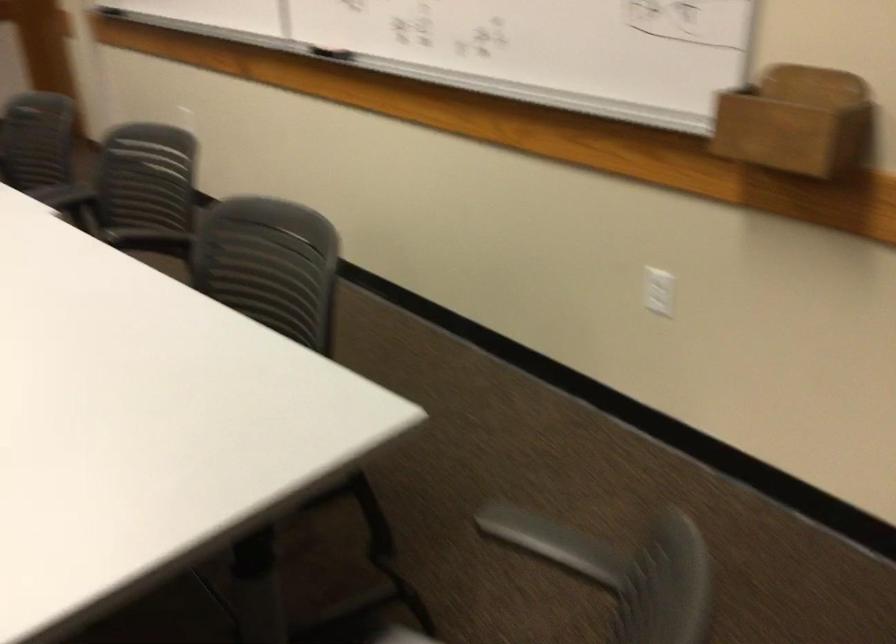
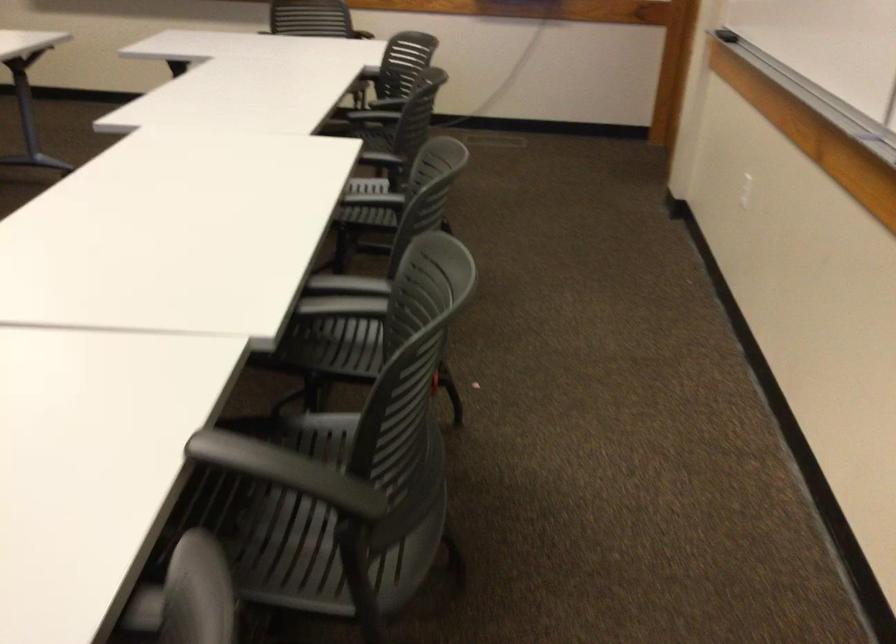
In the second image, find the point that corresponds to point 181,238 in the first image.

(286, 471)